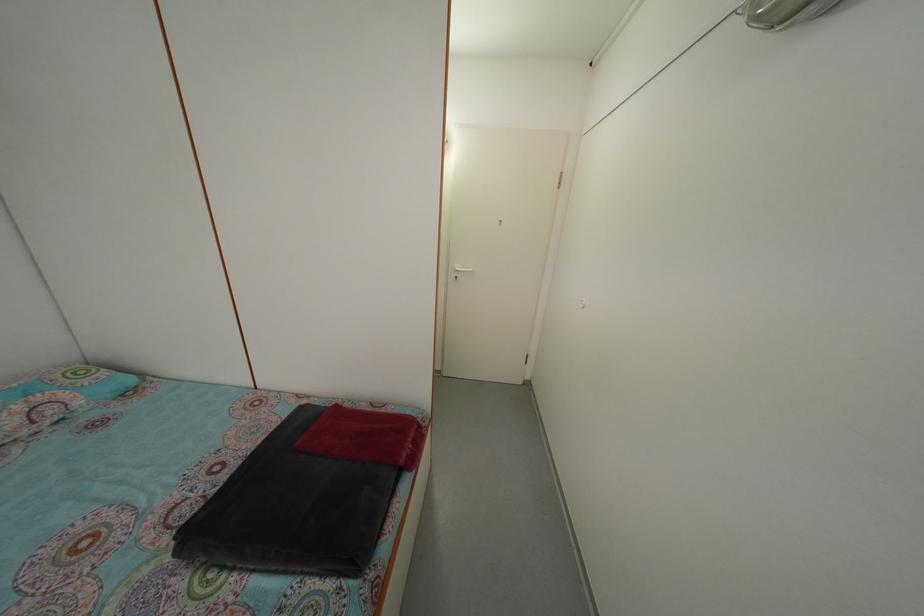
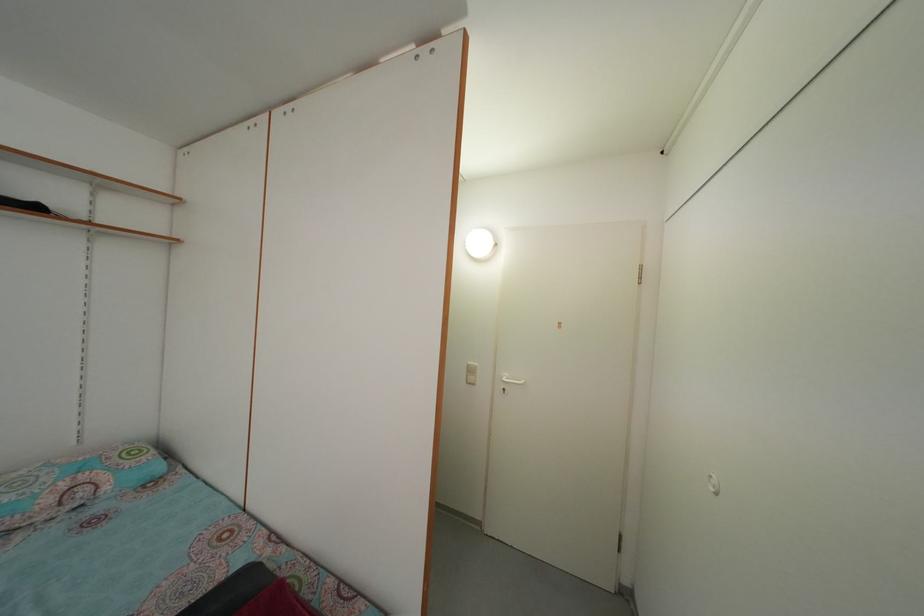
In a continuous first-person perspective shot, in which direction is the camera moving?

The cameraman walked toward right, forward.